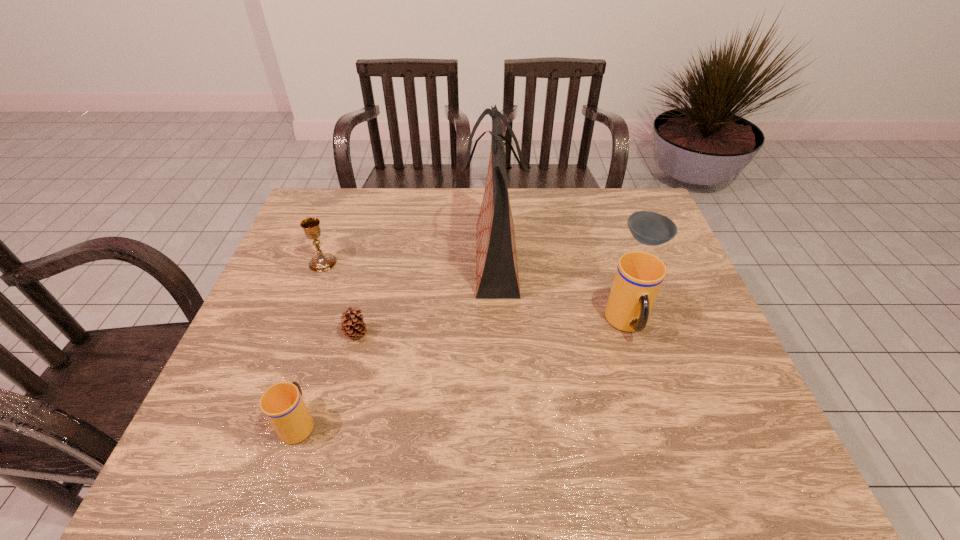
Identify the location of the left cup. pos(283,405).

At what (x,y) coordinates should I click in order to perform the action: click on the second object from left to right. Please return your answer as a coordinate pair (x, y). Image resolution: width=960 pixels, height=540 pixels. Looking at the image, I should click on (283, 405).

The image size is (960, 540). I want to click on the farther cup, so click(639, 275).

Where is `the right cup`? the right cup is located at coordinates (639, 275).

Image resolution: width=960 pixels, height=540 pixels. I want to click on the tallest object, so click(497, 277).

Where is `the fourth object from left to right`? This screenshot has height=540, width=960. the fourth object from left to right is located at coordinates (497, 277).

Identify the location of chalice. (321, 262).

Where is `the fourth shortest object`? The height and width of the screenshot is (540, 960). the fourth shortest object is located at coordinates (321, 262).

This screenshot has height=540, width=960. What are the coordinates of `bowl` in the screenshot? It's located at (649, 228).

Locate an element on the screen. the shortest object is located at coordinates (649, 228).